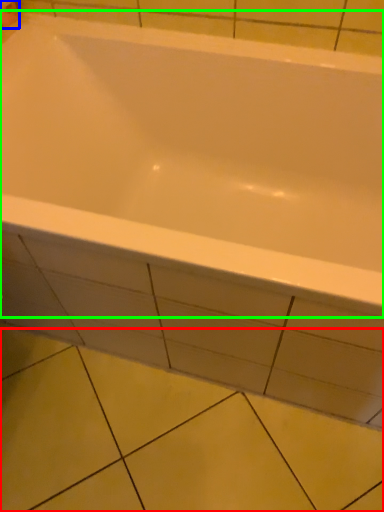
Question: Based on their relative distances, which object is farther from ceramic tile (highlighted by a red box)? Choose from toilet paper (highlighted by a blue box) and bathtub (highlighted by a green box).

Choices:
 (A) toilet paper
 (B) bathtub

Answer: (A)